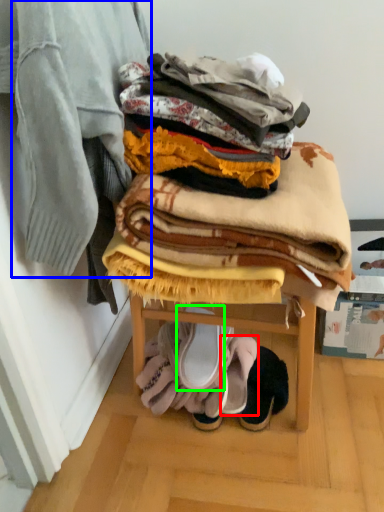
Question: Which object is positioned farthest from footwear (highlighted by a red box)? Select from blanket (highlighted by a blue box) and footwear (highlighted by a green box).

Choices:
 (A) blanket
 (B) footwear

Answer: (A)